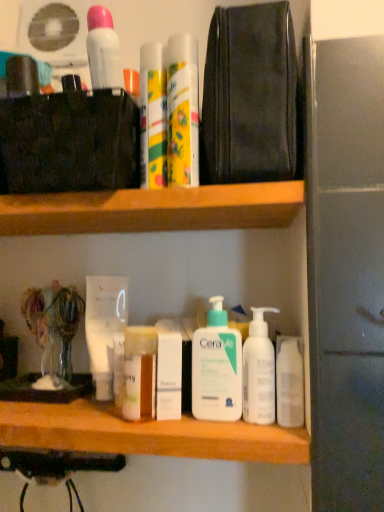
Question: From a real-world perspective, is white pump bottle at center, arranged as the 2th cleaning product when viewed from the left, on white pump bottle at center, the 2th cleaning product positioned from the right?

Choices:
 (A) no
 (B) yes

Answer: (A)

Question: Does white pump bottle at center, arranged as the 2th cleaning product when viewed from the left, have a larger size compared to white pump bottle at center, the 2th cleaning product positioned from the right?

Choices:
 (A) no
 (B) yes

Answer: (A)

Question: Does white pump bottle at center, acting as the first cleaning product starting from the right, touch white pump bottle at center, which is counted as the first cleaning product, starting from the left?

Choices:
 (A) yes
 (B) no

Answer: (A)

Question: Does white pump bottle at center, arranged as the 2th cleaning product when viewed from the left, turn towards white pump bottle at center, the 2th cleaning product positioned from the right?

Choices:
 (A) yes
 (B) no

Answer: (B)

Question: Does white pump bottle at center, arranged as the 2th cleaning product when viewed from the left, come in front of white pump bottle at center, which is counted as the first cleaning product, starting from the left?

Choices:
 (A) yes
 (B) no

Answer: (A)

Question: Is white matte lotion at center, the first toiletry when ordered from bottom to top, situated inside floral-patterned plastic mouthwash at upper center, arranged as the second mouthwash when ordered from the bottom, or outside?

Choices:
 (A) inside
 (B) outside

Answer: (B)

Question: From their relative heights in the image, would you say white matte lotion at center, which ranks as the third toiletry in top-to-bottom order, is taller or shorter than floral-patterned plastic mouthwash at upper center, placed as the first mouthwash when sorted from right to left?

Choices:
 (A) tall
 (B) short

Answer: (B)

Question: Looking at the image, does white matte lotion at center, the first toiletry when ordered from bottom to top, seem bigger or smaller compared to floral-patterned plastic mouthwash at upper center, placed as the first mouthwash when sorted from right to left?

Choices:
 (A) big
 (B) small

Answer: (B)

Question: Based on their positions, is white matte lotion at center, which ranks as the third toiletry in top-to-bottom order, located to the left or right of floral-patterned plastic mouthwash at upper center, the 2th mouthwash positioned from the front?

Choices:
 (A) right
 (B) left

Answer: (B)

Question: Looking at their shapes, would you say white matte tube at center, the third mouthwash from the front, is wider or thinner than white matte lotion at center, which ranks as the third toiletry in top-to-bottom order?

Choices:
 (A) wide
 (B) thin

Answer: (A)

Question: In the image, is white matte tube at center, which is the 1th mouthwash in bottom-to-top order, on the left side or the right side of white matte lotion at center, which ranks as the third toiletry in top-to-bottom order?

Choices:
 (A) right
 (B) left

Answer: (B)

Question: Is point tap(104, 297) closer or farther from the camera than point tap(157, 385)?

Choices:
 (A) farther
 (B) closer

Answer: (A)

Question: Relative to white matte lotion at center, which ranks as the third toiletry in top-to-bottom order, is white matte tube at center, which is the 1th mouthwash in bottom-to-top order, in front or behind?

Choices:
 (A) front
 (B) behind

Answer: (B)

Question: Relative to black leather pouch at upper center, is wooden at upper center in front or behind?

Choices:
 (A) front
 (B) behind

Answer: (B)

Question: From a real-world perspective, relative to black leather pouch at upper center, is wooden at upper center vertically above or below?

Choices:
 (A) above
 (B) below

Answer: (B)